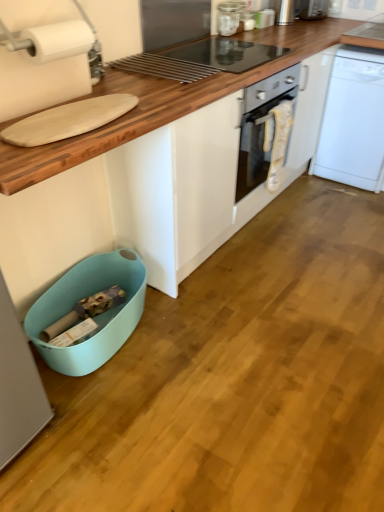
You are a GUI agent. You are given a task and a screenshot of the screen. Output one action in this format:
    pyautogui.click(x=<x>, y=<y>)
    Task: Click on the vacant region to the right of clear glass jar at upper center, the second appliance from the front
    
    Given the screenshot: What is the action you would take?
    pyautogui.click(x=250, y=35)